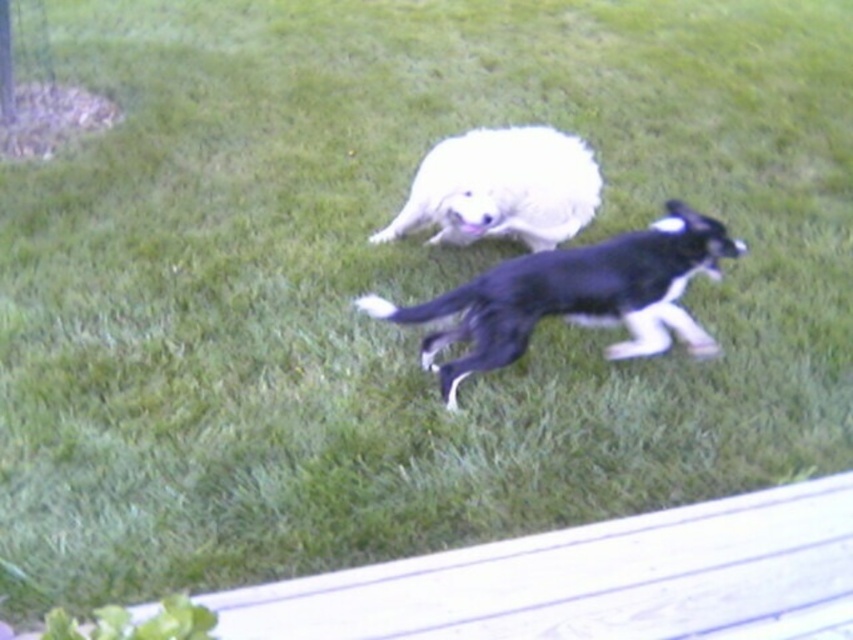
Question: Where is black matte dog at center located in relation to white fluffy dog at center in the image?

Choices:
 (A) right
 (B) left

Answer: (A)

Question: Does black matte dog at center have a greater width compared to white fluffy dog at center?

Choices:
 (A) no
 (B) yes

Answer: (B)

Question: Does black matte dog at center come behind white fluffy dog at center?

Choices:
 (A) yes
 (B) no

Answer: (B)

Question: Which of the following is the closest to the observer?

Choices:
 (A) (596, 284)
 (B) (547, 195)

Answer: (A)

Question: Which point is closer to the camera taking this photo?

Choices:
 (A) (575, 225)
 (B) (410, 317)

Answer: (B)